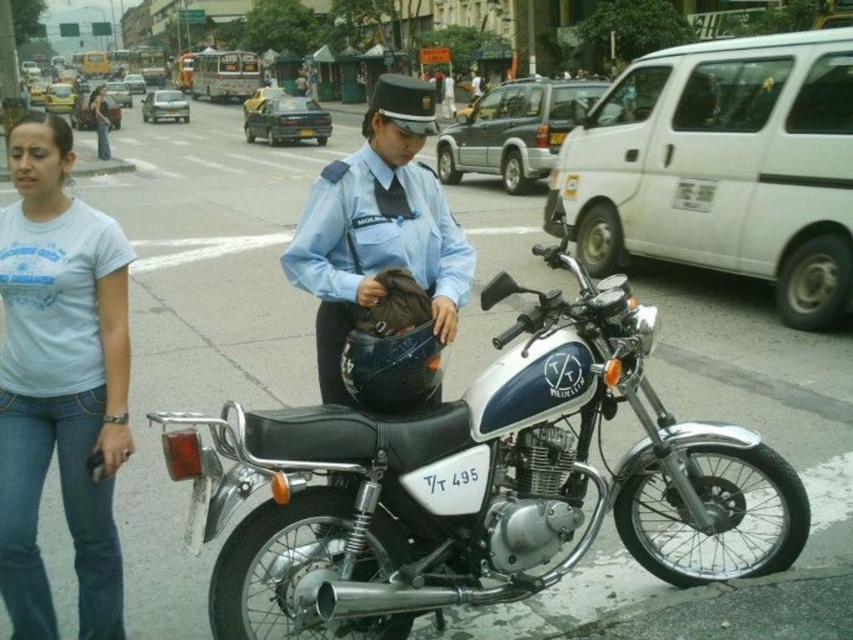
Between point (663, 490) and point (85, 621), which one is positioned behind?

Positioned behind is point (663, 490).

Does white metallic motorcycle at center have a lesser height compared to light blue cotton t-shirt at lower left?

Indeed, white metallic motorcycle at center has a lesser height compared to light blue cotton t-shirt at lower left.

Who is more forward, (494, 508) or (84, 365)?

A: Positioned in front is point (84, 365).

Where is `white metallic motorcycle at center`? The width and height of the screenshot is (853, 640). white metallic motorcycle at center is located at coordinates (477, 484).

What do you see at coordinates (61, 381) in the screenshot?
I see `light blue cotton t-shirt at lower left` at bounding box center [61, 381].

Who is more distant from viewer, (62, 397) or (409, 77)?

The point (409, 77) is more distant.

Is point (10, 128) farther from viewer compared to point (456, 320)?

Yes, point (10, 128) is farther from viewer.

Where is `light blue cotton t-shirt at lower left`? light blue cotton t-shirt at lower left is located at coordinates (61, 381).

Does white metallic motorcycle at center have a smaller size compared to light blue uniform at center?

Yes.

Can you confirm if white metallic motorcycle at center is bigger than light blue uniform at center?

Actually, white metallic motorcycle at center might be smaller than light blue uniform at center.

Where is `white metallic motorcycle at center`? The image size is (853, 640). white metallic motorcycle at center is located at coordinates (477, 484).